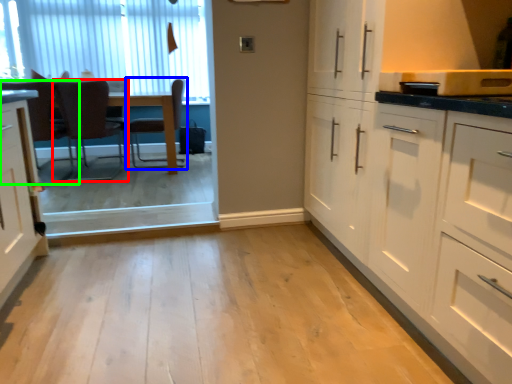
Question: Considering the real-world distances, which object is farthest from chair (highlighted by a red box)? chair (highlighted by a blue box) or chair (highlighted by a green box)?

Choices:
 (A) chair
 (B) chair

Answer: (A)